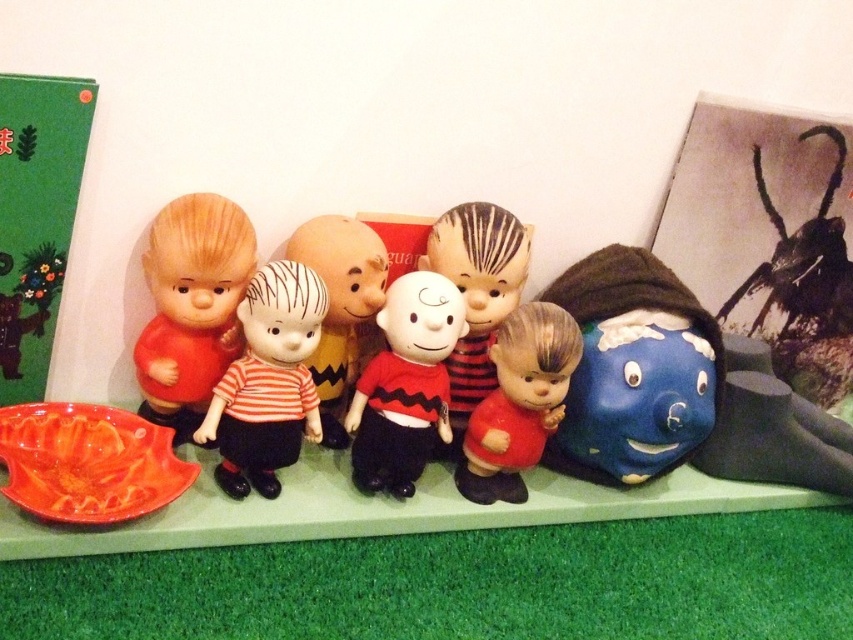
Locate an element on the screen. The width and height of the screenshot is (853, 640). matte plastic charlie brown at center is located at coordinates (405, 385).

Consider the image. Who is positioned more to the right, matte plastic charlie brown at center or matte plastic child at center?

Positioned to the right is matte plastic child at center.

This screenshot has width=853, height=640. Describe the element at coordinates (405, 385) in the screenshot. I see `matte plastic charlie brown at center` at that location.

The height and width of the screenshot is (640, 853). What are the coordinates of `matte plastic charlie brown at center` in the screenshot? It's located at (405, 385).

Between matte orange platter at lower left and matte plastic charlie brown doll at center, which one has less height?

matte orange platter at lower left is shorter.

Does matte orange platter at lower left appear over matte plastic charlie brown doll at center?

Incorrect, matte orange platter at lower left is not positioned above matte plastic charlie brown doll at center.

This screenshot has height=640, width=853. What do you see at coordinates (88, 461) in the screenshot? I see `matte orange platter at lower left` at bounding box center [88, 461].

The image size is (853, 640). In order to click on matte orange platter at lower left in this screenshot , I will do `click(88, 461)`.

Who is positioned more to the left, blue matte head at right or matte orange platter at lower left?

matte orange platter at lower left

Between blue matte head at right and matte orange platter at lower left, which one appears on the right side from the viewer's perspective?

From the viewer's perspective, blue matte head at right appears more on the right side.

What do you see at coordinates (717, 380) in the screenshot? I see `blue matte head at right` at bounding box center [717, 380].

Identify the location of blue matte head at right. (717, 380).